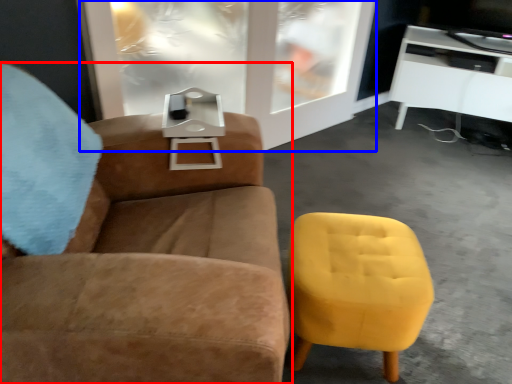
Question: Which object is further to the camera taking this photo, chair (highlighted by a red box) or glass door (highlighted by a blue box)?

Choices:
 (A) chair
 (B) glass door

Answer: (B)